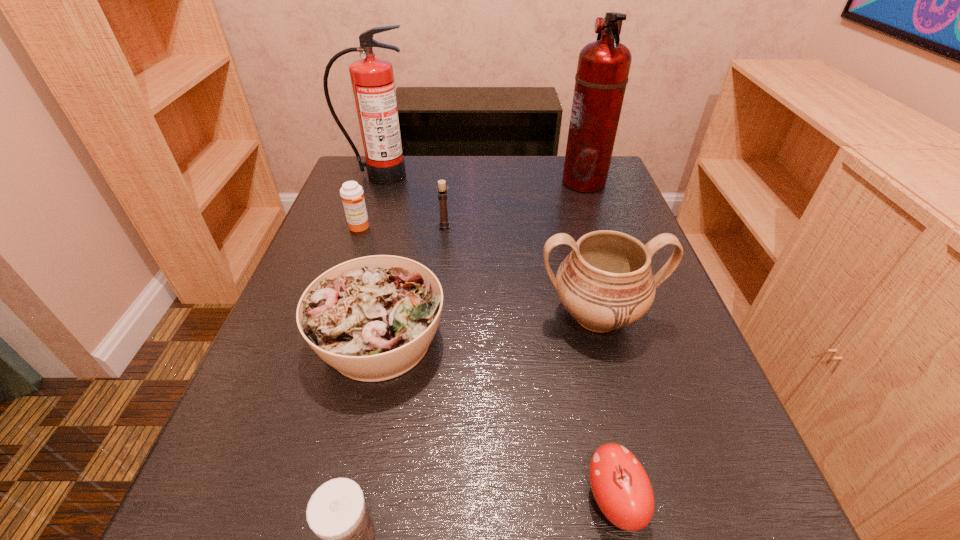
This screenshot has width=960, height=540. I want to click on vacant region located on the front-facing side of the sixth shortest object, so click(648, 509).

Identify the location of free spot located 0.290m on the right of the candle holder. Image resolution: width=960 pixels, height=540 pixels. (577, 225).

This screenshot has height=540, width=960. I want to click on free space located on the right of the salad, so click(533, 340).

The image size is (960, 540). What are the coordinates of `vacant region located 0.350m on the front of the left medicine` in the screenshot? It's located at (313, 361).

The image size is (960, 540). In order to click on fire extinguisher at the left edge in this screenshot , I will do `click(372, 79)`.

At what (x,y) coordinates should I click in order to perform the action: click on salad that is positioned at the left edge. Please return your answer as a coordinate pair (x, y). The width and height of the screenshot is (960, 540). Looking at the image, I should click on (372, 318).

Image resolution: width=960 pixels, height=540 pixels. In order to click on medicine present at the left edge in this screenshot , I will do `click(351, 193)`.

This screenshot has width=960, height=540. Identify the location of fire extinguisher present at the right edge. (603, 67).

Where is `urn positioned at the right edge`? Image resolution: width=960 pixels, height=540 pixels. urn positioned at the right edge is located at coordinates (606, 282).

Where is `object located at the far left corner`? The image size is (960, 540). object located at the far left corner is located at coordinates (372, 79).